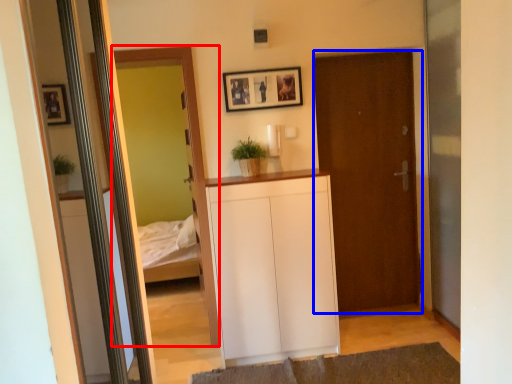
Question: Which of the following is the farthest to the observer, mirror (highlighted by a red box) or door (highlighted by a blue box)?

Choices:
 (A) mirror
 (B) door

Answer: (B)